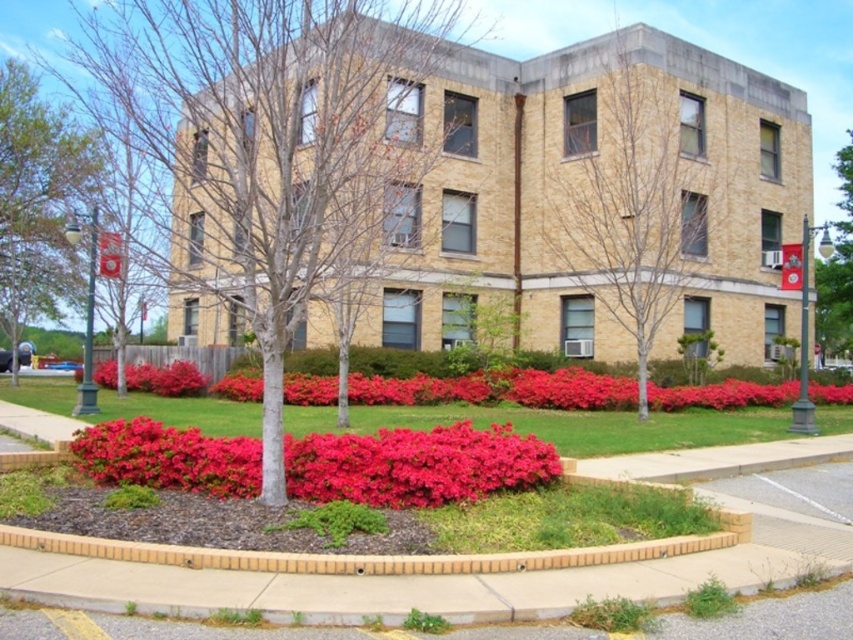
Looking at this image, you are standing at point A with coordinates point A at (358, 397) and want to walk to point B at 0.377, 0.579. The path between them is straight. Given that the maximum distance you can walk is 20 meters, will you be able to reach point B from point A?

The distance between point A at (358, 397) and point B at 0.377, 0.579 is 20.49 meters. Since this exceeds the maximum distance you can walk of 20 meters, you will not be able to reach point B from point A.

You are standing in front of the building and want to reach the point marked at coordinates (161, 548). Is this point closer to you or further away than the red azalea bushes?

The point marked at coordinates (161, 548) is 5.97 meters from the viewer, so it is further away than the red azalea bushes which are in front of the building.

You are standing on the sidewalk in front of the building. You want to walk to the vibrant red petals at center. Which direction should you walk to avoid the green leafy tree at left?

To reach the vibrant red petals at center while avoiding the green leafy tree at left, you should walk towards the right side of the scene. This way, you can bypass the tree since the petals are positioned behind the tree and to the right.